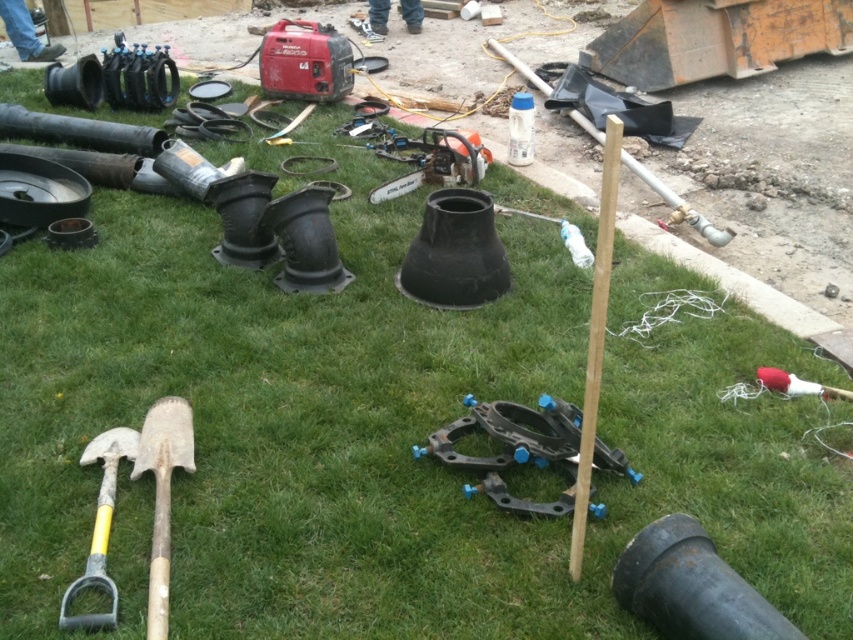
You are a construction worker standing at the edge of the dirt patch and need to locate two specific points marked in the scene. Which of the two points, point (485, 464) or point (102, 456), is closer to your current position?

Point (485, 464) is closer to your current position because it is further to the viewer than point (102, 456), meaning it is nearer to you.

Looking at this image, you are a construction worker who needs to retrieve the black plastic clamps at center for a repair. You are currently standing next to the yellow handle shovel at lower left. In which direction should you move to reach the clamps?

The black plastic clamps at center is to the right of the yellow handle shovel at lower left. You should move to your right to reach the clamps.

You are a worker standing at the edge of the construction site. You need to reach the black plastic clamps at center to secure a pipe. Considering your reach is about 7 feet, can you grab them without moving your position?

The black plastic clamps at center are 7.53 feet away from the camera, which is beyond your reach of 7 feet. You will need to move closer to grab them.